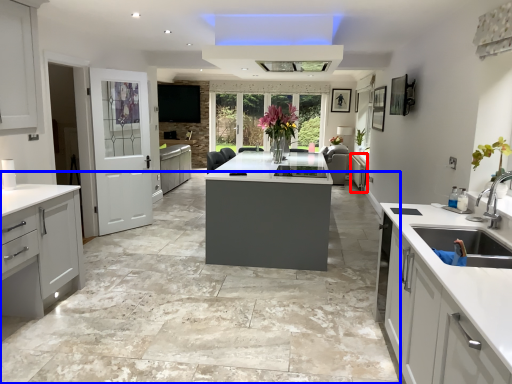
Question: Among these objects, which one is nearest to the camera, cabinetry (highlighted by a red box) or concrete (highlighted by a blue box)?

Choices:
 (A) cabinetry
 (B) concrete

Answer: (B)